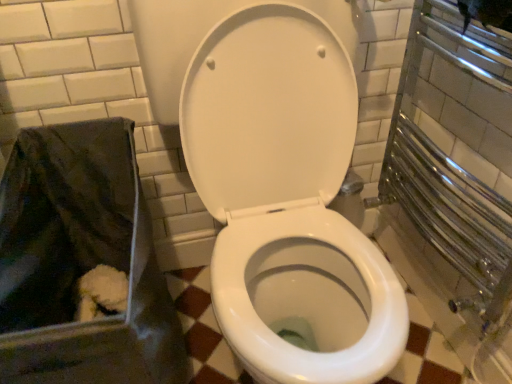
Question: From the image's perspective, is white glossy toilet at center located above or below black fabric bag at lower left?

Choices:
 (A) above
 (B) below

Answer: (A)

Question: Does point (406, 322) appear closer or farther from the camera than point (105, 124)?

Choices:
 (A) closer
 (B) farther

Answer: (A)

Question: In terms of height, does white glossy toilet at center look taller or shorter compared to black fabric bag at lower left?

Choices:
 (A) tall
 (B) short

Answer: (A)

Question: From a real-world perspective, relative to white glossy toilet at center, is black fabric bag at lower left vertically above or below?

Choices:
 (A) above
 (B) below

Answer: (B)

Question: From the image's perspective, relative to white glossy toilet at center, is black fabric bag at lower left above or below?

Choices:
 (A) above
 (B) below

Answer: (B)

Question: Is point (81, 347) closer or farther from the camera than point (326, 380)?

Choices:
 (A) closer
 (B) farther

Answer: (A)

Question: Looking at the image, does black fabric bag at lower left seem bigger or smaller compared to white glossy toilet at center?

Choices:
 (A) small
 (B) big

Answer: (A)